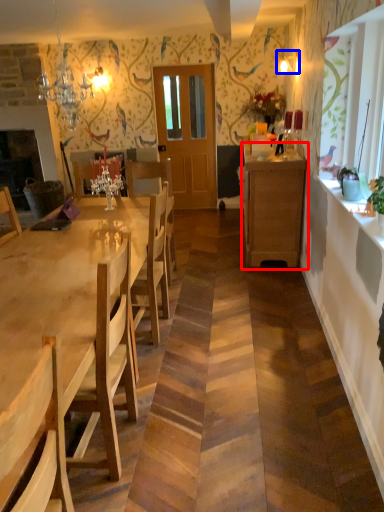
Question: Which object appears farthest to the camera in this image, cabinetry (highlighted by a red box) or lamp (highlighted by a blue box)?

Choices:
 (A) cabinetry
 (B) lamp

Answer: (B)